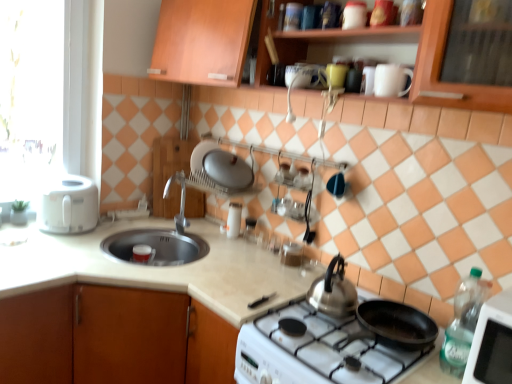
Locate an element on the screen. The height and width of the screenshot is (384, 512). unoccupied area in front of white glossy soap dispenser at upper center, the 2th appliance in the bottom-to-top sequence is located at coordinates (229, 242).